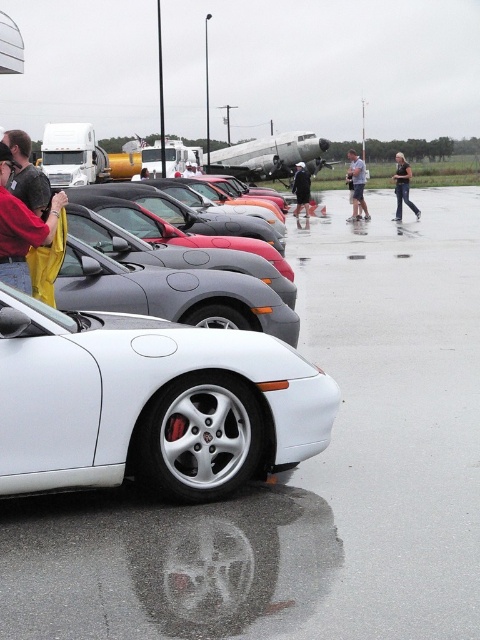
Question: Which of these objects is positioned closest to the denim pants at center?

Choices:
 (A) satin silver metallic sports car at center
 (B) brushed metal camper at upper center

Answer: (B)

Question: Which point is farther from the camera taking this photo?

Choices:
 (A) (179, 157)
 (B) (250, 180)

Answer: (B)

Question: Can you confirm if shiny black car at center is positioned to the left of yellow fabric at left?

Choices:
 (A) no
 (B) yes

Answer: (B)

Question: Does yellow fabric at left appear over dark blue jacket at center?

Choices:
 (A) no
 (B) yes

Answer: (A)

Question: Is shiny black car at center above brushed metal camper at upper center?

Choices:
 (A) no
 (B) yes

Answer: (A)

Question: Estimate the real-world distances between objects in this image. Which object is farther from the shiny black car at center?

Choices:
 (A) dark blue jacket at center
 (B) metallic silver airplane at center

Answer: (B)